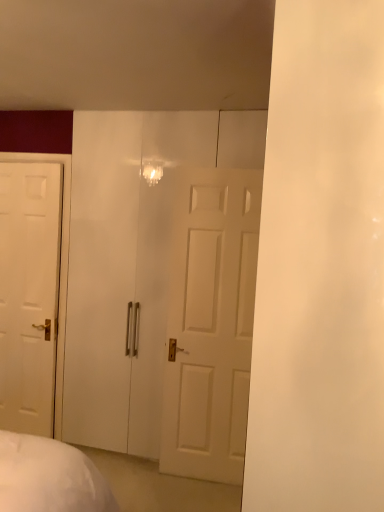
Describe the element at coordinates (29, 293) in the screenshot. I see `white glossy door at left` at that location.

You are a GUI agent. You are given a task and a screenshot of the screen. Output one action in this format:
    pyautogui.click(x=<x>, y=<y>)
    Task: Click on the white glossy door at left
    This screenshot has width=384, height=512.
    Given the screenshot: What is the action you would take?
    pyautogui.click(x=29, y=293)

In order to face white glossy door at left, should I rotate leftwards or rightwards?

A 21.746 degree turn to the left will do.

Measure the distance between point (9, 371) and camera.

Point (9, 371) is 3.10 meters away from camera.

What do you see at coordinates (162, 292) in the screenshot? I see `transparent glass door at center` at bounding box center [162, 292].

Where is `transparent glass door at center`? The height and width of the screenshot is (512, 384). transparent glass door at center is located at coordinates (162, 292).

Where is `white glossy door at left`? Image resolution: width=384 pixels, height=512 pixels. white glossy door at left is located at coordinates (29, 293).

In the image, is white glossy door at left on the left side or the right side of transparent glass door at center?

In the image, white glossy door at left appears on the left side of transparent glass door at center.

Between white glossy door at left and transparent glass door at center, which one is positioned behind?

white glossy door at left is further from the camera.

Does point (39, 253) appear closer or farther from the camera than point (208, 433)?

Clearly, point (39, 253) is more distant from the camera than point (208, 433).

From the image's perspective, which one is positioned lower, white glossy door at left or transparent glass door at center?

From the image's view, white glossy door at left is below.

From a real-world perspective, which object stands above the other?

transparent glass door at center.

Considering the sizes of objects white glossy door at left and transparent glass door at center in the image provided, who is wider, white glossy door at left or transparent glass door at center?

white glossy door at left.

Is white glossy door at left taller than transparent glass door at center?

Incorrect, the height of white glossy door at left is not larger of that of transparent glass door at center.

Considering the sizes of objects white glossy door at left and transparent glass door at center in the image provided, who is bigger, white glossy door at left or transparent glass door at center?

Bigger between the two is transparent glass door at center.

Is transparent glass door at center inside white glossy door at left?

No, transparent glass door at center is located outside of white glossy door at left.

In the scene shown: Are white glossy door at left and transparent glass door at center far apart?

No.

Is white glossy door at left aimed at transparent glass door at center?

No, white glossy door at left is not facing towards transparent glass door at center.

How many degrees apart are the facing directions of white glossy door at left and transparent glass door at center?

1.1 degrees.

The width and height of the screenshot is (384, 512). What are the coordinates of `glass door that is on the right side of white glossy door at left` in the screenshot? It's located at (162, 292).

Would you say transparent glass door at center is to the left or to the right of white glossy door at left in the picture?

transparent glass door at center is positioned on white glossy door at left's right side.

Considering the relative positions of transparent glass door at center and white glossy door at left in the image provided, is transparent glass door at center in front of white glossy door at left?

Yes, transparent glass door at center is closer to the camera.

Between point (179, 283) and point (18, 165), which one is positioned behind?

The point (18, 165) is behind.

From the image's perspective, is transparent glass door at center beneath white glossy door at left?

No, from the image's perspective, transparent glass door at center is not beneath white glossy door at left.

From a real-world perspective, who is located lower, transparent glass door at center or white glossy door at left?

In real-world perspective, white glossy door at left is lower.

Is transparent glass door at center wider or thinner than white glossy door at left?

In the image, transparent glass door at center appears to be more narrow than white glossy door at left.

Does transparent glass door at center have a greater height compared to white glossy door at left?

Indeed, transparent glass door at center has a greater height compared to white glossy door at left.

Can you confirm if transparent glass door at center is bigger than white glossy door at left?

Yes.

Would you say transparent glass door at center is outside white glossy door at left?

Yes, transparent glass door at center is outside of white glossy door at left.

Is transparent glass door at center not near white glossy door at left?

No, transparent glass door at center is not far away from white glossy door at left.

Could you tell me if transparent glass door at center is turned towards white glossy door at left?

No, transparent glass door at center does not turn towards white glossy door at left.

Where is `glass door located above the white glossy door at left (from the image's perspective)`? The height and width of the screenshot is (512, 384). glass door located above the white glossy door at left (from the image's perspective) is located at coordinates (162, 292).

This screenshot has height=512, width=384. I want to click on glass door in front of the white glossy door at left, so click(162, 292).

The image size is (384, 512). I want to click on door on the left of transparent glass door at center, so click(x=29, y=293).